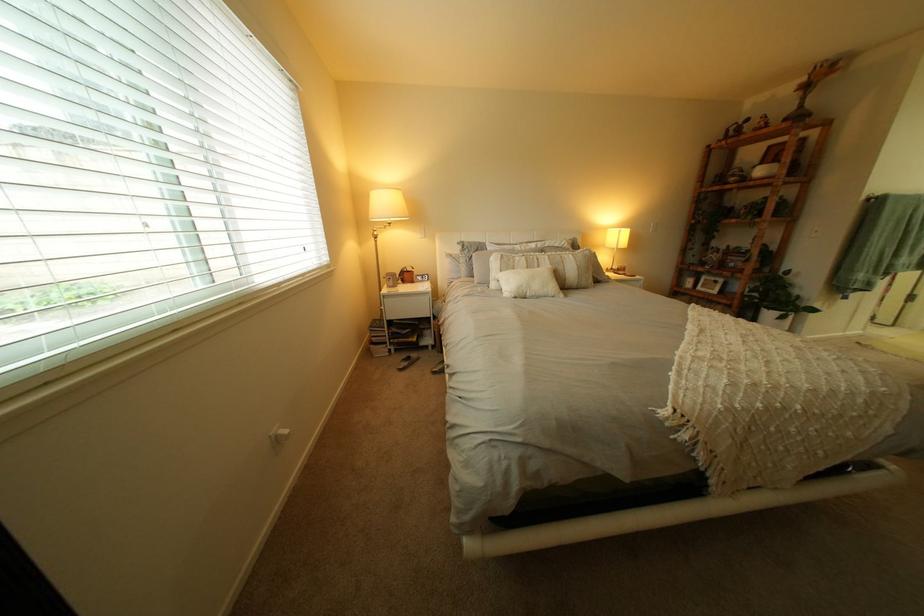
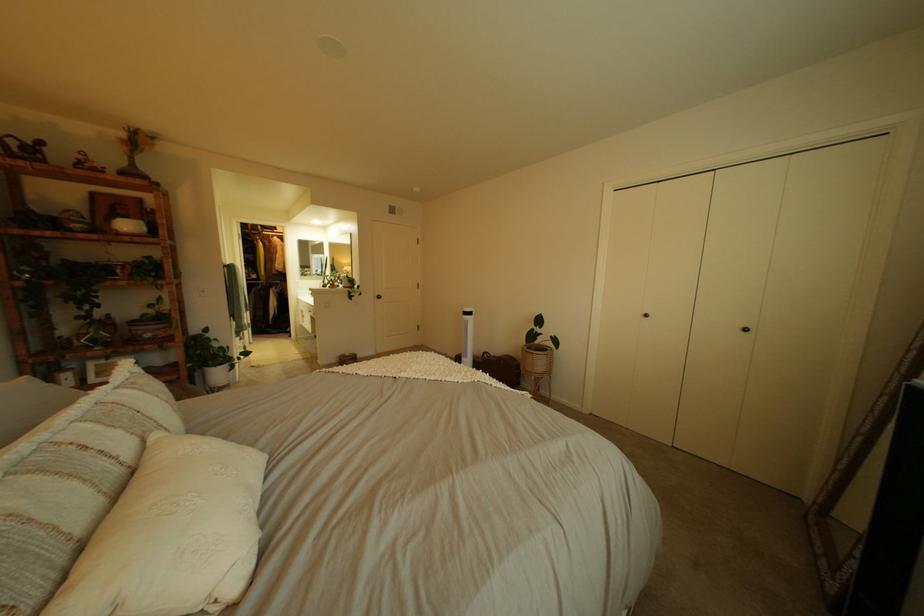
In the second image, find the point that corresponds to pixel 754 248 in the first image.

(161, 315)